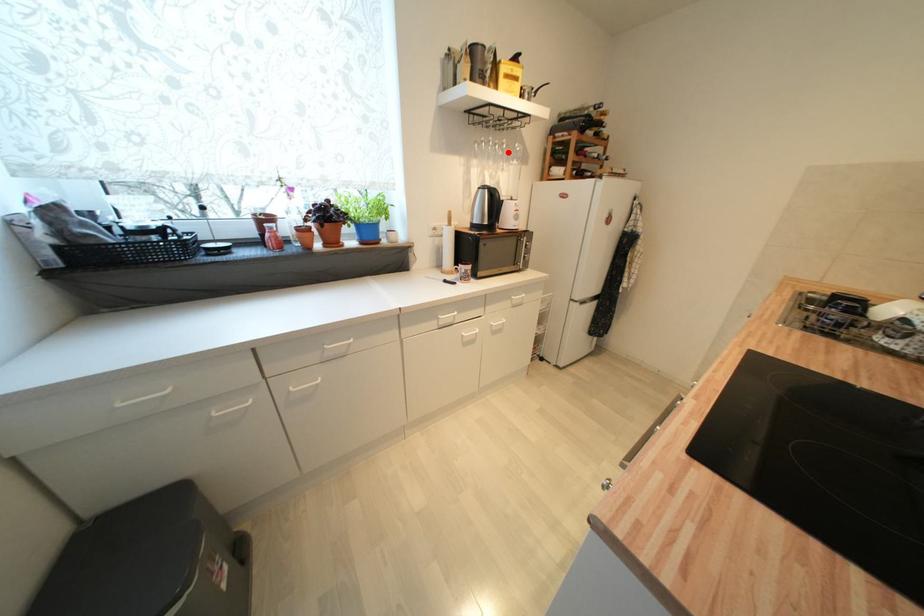
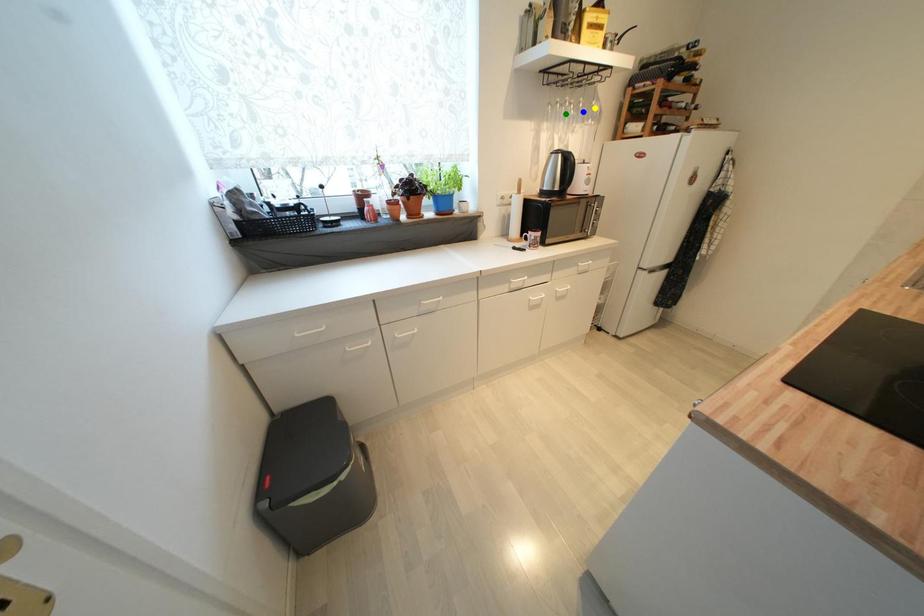
Question: I am providing you with two images of the same scene from different viewpoints. A red point is marked on the first image. You are given multiple points on the second image. Which mark in image 2 goes with the point in image 1?

Choices:
 (A) yellow point
 (B) blue point
 (C) green point

Answer: (B)